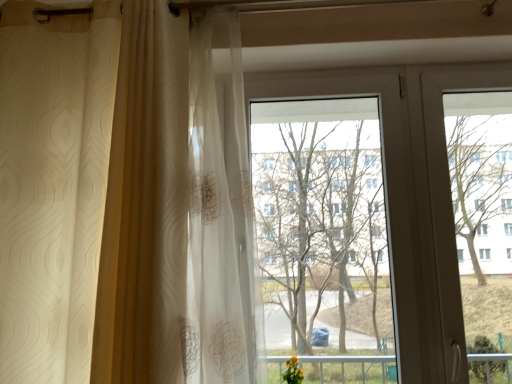
What do you see at coordinates (127, 200) in the screenshot?
I see `white sheer curtain at left` at bounding box center [127, 200].

The width and height of the screenshot is (512, 384). Identify the location of transparent glass window at center. pyautogui.click(x=410, y=196).

From the picture: Is transparent glass window at center inside white sheer curtain at left?

No, transparent glass window at center is not a part of white sheer curtain at left.

Is white sheer curtain at left aimed at transparent glass window at center?

No, white sheer curtain at left is not oriented towards transparent glass window at center.

Are white sheer curtain at left and transparent glass window at center located far from each other?

No, white sheer curtain at left is not far away from transparent glass window at center.

Which is behind, point (460, 301) or point (131, 238)?

Positioned behind is point (460, 301).

Is transparent plastic screen door at right outside of white sheer curtain at left?

That's correct, transparent plastic screen door at right is outside of white sheer curtain at left.

How many degrees apart are the facing directions of transparent plastic screen door at right and white sheer curtain at left?

1.12 degrees.

Does transparent plastic screen door at right touch white sheer curtain at left?

They are not placed beside each other.

From the picture: From the image's perspective, which object appears higher, transparent plastic screen door at right or transparent glass window at center?

From the image's view, transparent plastic screen door at right is above.

Is transparent plastic screen door at right inside or outside of transparent glass window at center?

transparent plastic screen door at right is located beyond the bounds of transparent glass window at center.

Does transparent plastic screen door at right have a greater height compared to transparent glass window at center?

No, transparent plastic screen door at right is not taller than transparent glass window at center.

In the image, there is a transparent plastic screen door at right. At what (x,y) coordinates should I click in order to perform the action: click on bay window below it (from a real-world perspective). Please return your answer as a coordinate pair (x, y). Looking at the image, I should click on (410, 196).

Is transparent glass window at center aimed at transparent plastic screen door at right?

No, transparent glass window at center is not oriented towards transparent plastic screen door at right.

From a real-world perspective, which object stands above the other?

transparent plastic screen door at right.

Considering the positions of objects transparent glass window at center and transparent plastic screen door at right in the image provided, who is more to the right, transparent glass window at center or transparent plastic screen door at right?

Positioned to the right is transparent plastic screen door at right.

Is white sheer curtain at left wider or thinner than transparent plastic screen door at right?

In the image, white sheer curtain at left appears to be wider than transparent plastic screen door at right.

Is white sheer curtain at left positioned with its back to transparent plastic screen door at right?

white sheer curtain at left does not have its back to transparent plastic screen door at right.

Which is more to the right, white sheer curtain at left or transparent plastic screen door at right?

transparent plastic screen door at right is more to the right.

How different are the orientations of transparent glass window at center and white sheer curtain at left in degrees?

1.06 degrees.

Is transparent glass window at center oriented towards white sheer curtain at left?

No, transparent glass window at center is not facing towards white sheer curtain at left.

Is the position of transparent glass window at center less distant than that of white sheer curtain at left?

That is False.

Which is more to the right, transparent glass window at center or white sheer curtain at left?

From the viewer's perspective, transparent glass window at center appears more on the right side.

Where is `curtain on the left of transparent glass window at center`? The height and width of the screenshot is (384, 512). curtain on the left of transparent glass window at center is located at coordinates (127, 200).

Image resolution: width=512 pixels, height=384 pixels. Identify the location of curtain above the transparent plastic screen door at right (from the image's perspective). (127, 200).

Considering their positions, is white sheer curtain at left positioned closer to transparent plastic screen door at right than transparent glass window at center?

transparent glass window at center.

When comparing their distances from white sheer curtain at left, does transparent plastic screen door at right or transparent glass window at center seem further?

transparent plastic screen door at right is further to white sheer curtain at left.

In the scene shown: When comparing their distances from transparent plastic screen door at right, does transparent glass window at center or white sheer curtain at left seem closer?

Based on the image, transparent glass window at center appears to be nearer to transparent plastic screen door at right.

Based on their spatial positions, is transparent glass window at center or transparent plastic screen door at right closer to white sheer curtain at left?

The object closer to white sheer curtain at left is transparent glass window at center.

Based on their spatial positions, is white sheer curtain at left or transparent plastic screen door at right closer to transparent glass window at center?

Based on the image, transparent plastic screen door at right appears to be nearer to transparent glass window at center.

Based on their spatial positions, is transparent plastic screen door at right or white sheer curtain at left closer to transparent glass window at center?

transparent plastic screen door at right lies closer to transparent glass window at center than the other object.

Locate an element on the screen. bay window situated between white sheer curtain at left and transparent plastic screen door at right from left to right is located at coordinates coord(410,196).